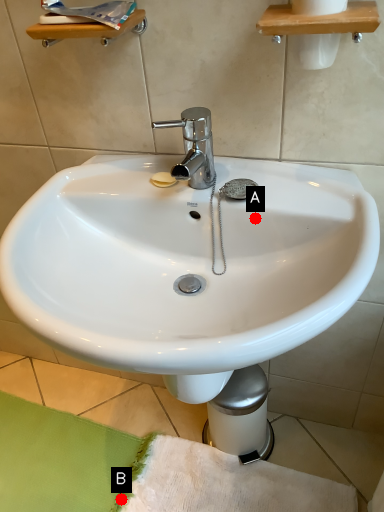
Question: Two points are circled on the image, labeled by A and B beside each circle. Which point is farther from the camera taking this photo?

Choices:
 (A) A is further
 (B) B is further

Answer: (B)